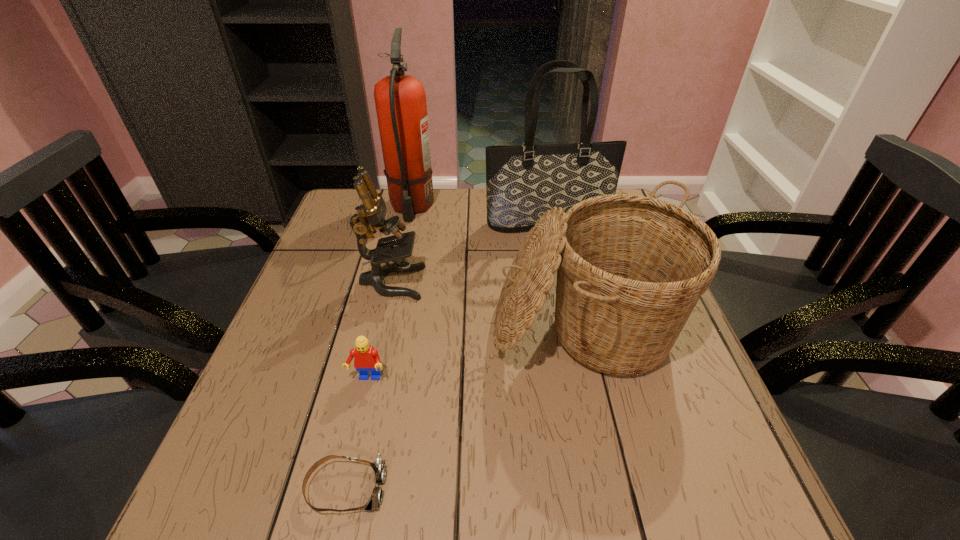
I want to click on vacant space located 0.250m on the back of the basket, so click(558, 224).

The width and height of the screenshot is (960, 540). I want to click on free space located 0.170m on the front-facing side of the second shortest object, so click(x=346, y=471).

At what (x,y) coordinates should I click in order to perform the action: click on free space located on the front-facing side of the goggles. Please return your answer as a coordinate pair (x, y). Looking at the image, I should click on (604, 488).

Locate an element on the screen. This screenshot has width=960, height=540. fire extinguisher that is at the far edge is located at coordinates (400, 100).

Identify the location of tote bag at the far edge. (523, 181).

Locate an element on the screen. The width and height of the screenshot is (960, 540). object positioned at the near edge is located at coordinates (375, 500).

Find the location of a particular element. The height and width of the screenshot is (540, 960). object located in the left edge section of the desktop is located at coordinates tap(371, 214).

Find the location of a particular element. tote bag located in the right edge section of the desktop is located at coordinates (523, 181).

Locate an element on the screen. Image resolution: width=960 pixels, height=540 pixels. basket that is at the right edge is located at coordinates (630, 269).

Identify the location of object that is at the far right corner. The image size is (960, 540). point(523,181).